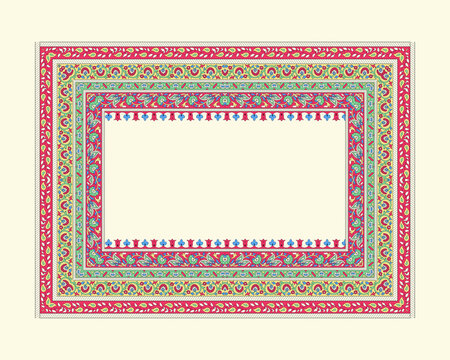
Where is `outside border of rug`? The image size is (450, 360). outside border of rug is located at coordinates (207, 307).